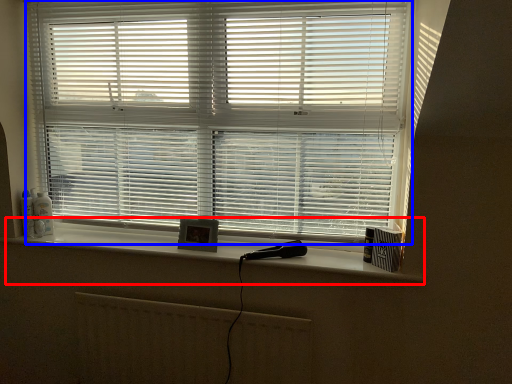
Question: Among these objects, which one is farthest to the camera, window sill (highlighted by a red box) or window blind (highlighted by a blue box)?

Choices:
 (A) window sill
 (B) window blind

Answer: (A)